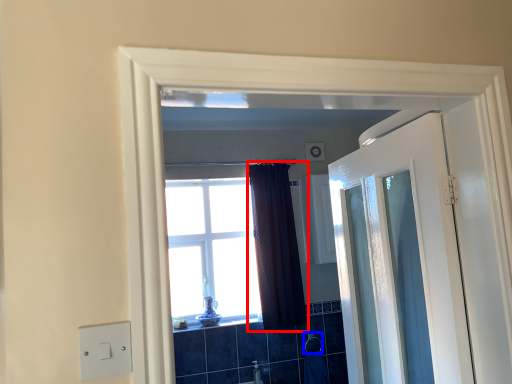
Question: Which point is further to the camera, curtain (highlighted by a red box) or towel bar (highlighted by a blue box)?

Choices:
 (A) curtain
 (B) towel bar

Answer: (B)